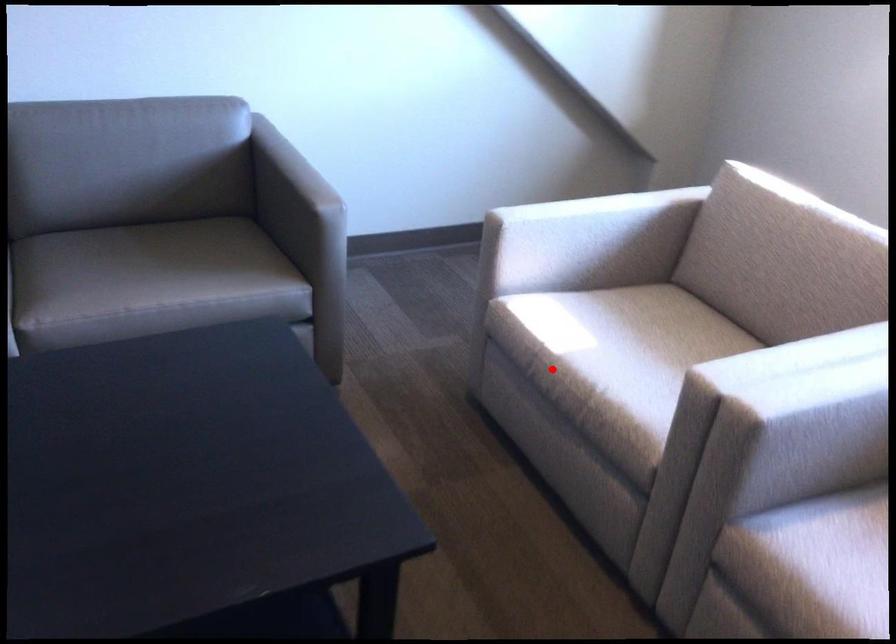
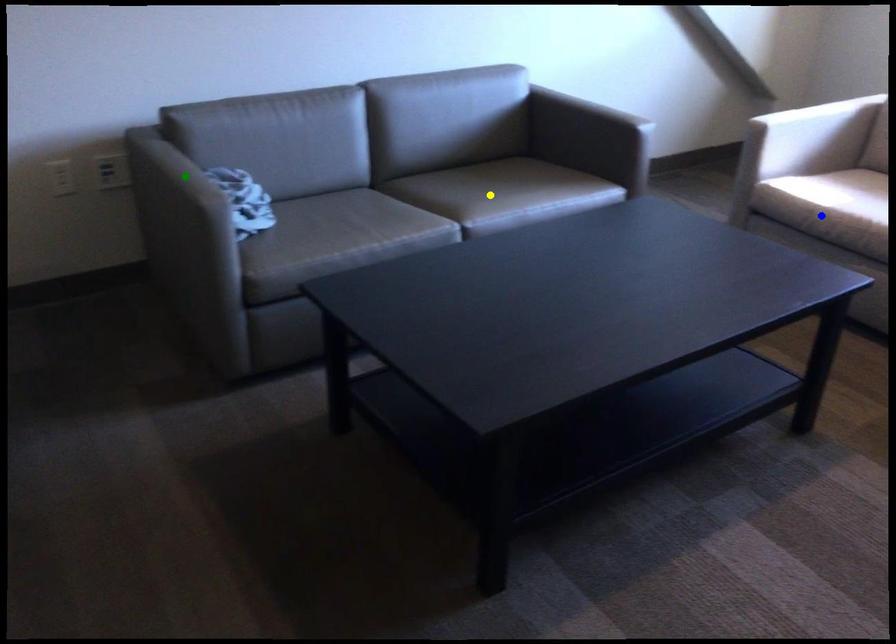
Question: I am providing you with two images of the same scene from different viewpoints. A red point is marked on the first image. You are given multiple points on the second image. Can you choose the point in image 2 that corresponds to the point in image 1?

Choices:
 (A) blue point
 (B) yellow point
 (C) green point

Answer: (A)